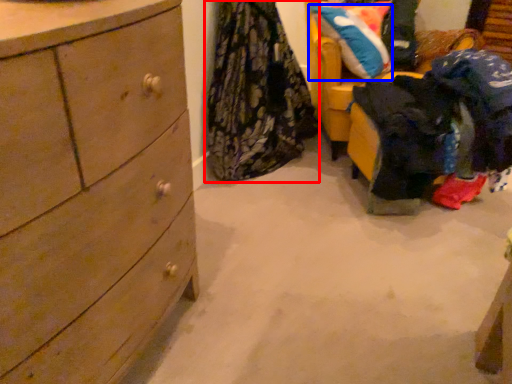
Question: Among these objects, which one is farthest to the camera, clothing (highlighted by a red box) or pillow (highlighted by a blue box)?

Choices:
 (A) clothing
 (B) pillow

Answer: (B)